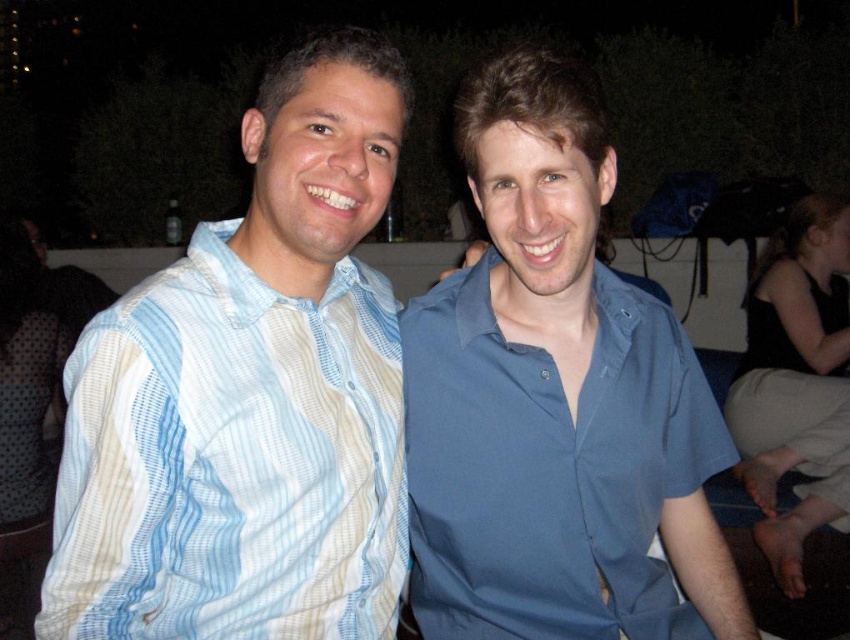
You are a photographer standing at a certain distance from the blue cotton shirt at center. You want to capture a closeup shot of it without moving the shirt or yourself. Is the current distance sufficient for a detailed closeup?

The blue cotton shirt at center is 91.30 centimeters away from the camera. Whether this distance is sufficient for a detailed closeup depends on the camera lens used. A standard lens might require closer proximity, while a macro or telephoto lens could achieve clarity at this distance. Ensure your equipment can focus effectively at 91.30 cm for optimal results.

You are a photographer trying to capture a clear shot of the blue striped shirt at left and the black fabric at lower right in the image. Since the camera can only focus on one object at a time, which object should you choose to ensure the smaller one is in focus?

The blue striped shirt at left is smaller than the black fabric at lower right, so you should focus on the blue striped shirt at left to ensure it is in focus.